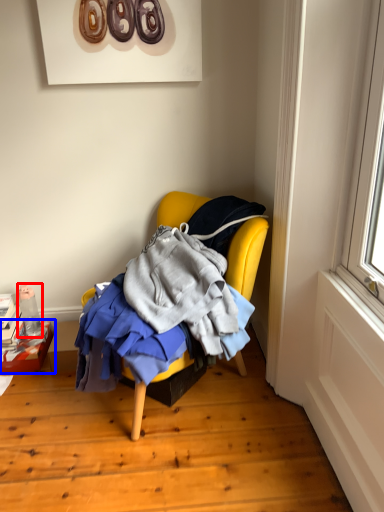
Question: Which of the following is the farthest to the observer, bottle (highlighted by a red box) or box (highlighted by a blue box)?

Choices:
 (A) bottle
 (B) box

Answer: (A)